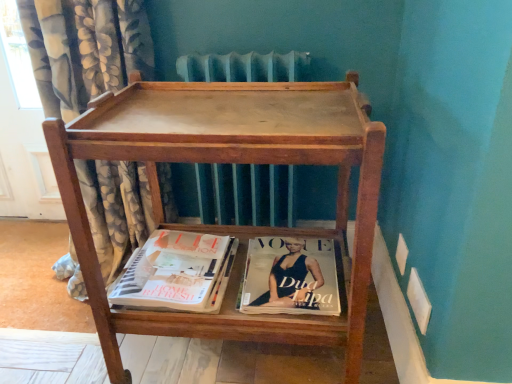
The image size is (512, 384). In order to click on vacant area on top of matte paper magazine at lower center (from a real-world perspective) in this screenshot , I will do `click(164, 259)`.